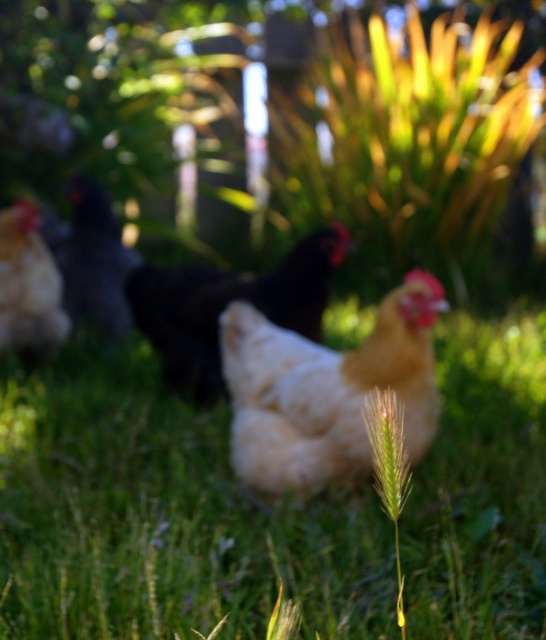
You are a farmer checking the chickens in the scene. You notice the white fluffy chicken at center and the black matte chicken at left. Which chicken is shorter?

The white fluffy chicken at center is shorter than the black matte chicken at left.

You are a photographer trying to capture a photo of the white matte chicken at center and the matte yellow chicken at left. Based on their positions, which chicken is positioned more to the right side of the image?

The white matte chicken at center is positioned more to the right side of the image compared to the matte yellow chicken at left.